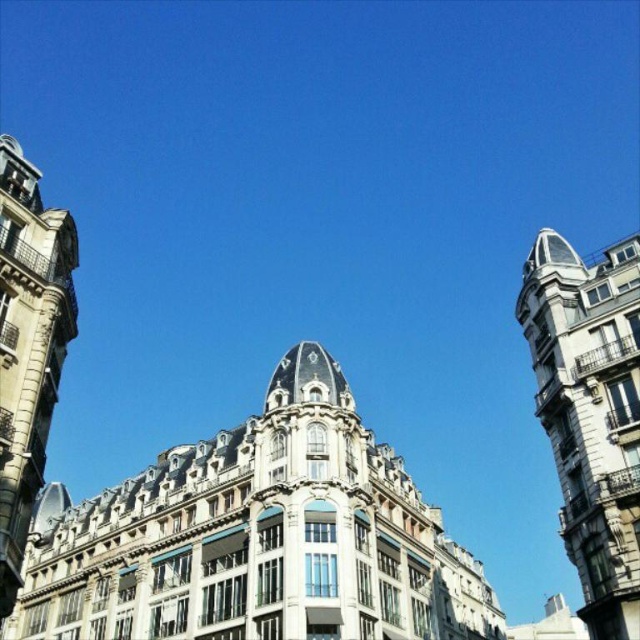
Describe the element at coordinates (257, 538) in the screenshot. I see `white stone building at center` at that location.

The width and height of the screenshot is (640, 640). In order to click on white stone building at center in this screenshot , I will do `click(257, 538)`.

You are a GUI agent. You are given a task and a screenshot of the screen. Output one action in this format:
    pyautogui.click(x=<x>, y=<y>)
    Task: Click on the white stone building at center
    
    Given the screenshot: What is the action you would take?
    pyautogui.click(x=257, y=538)

Does point (632, 449) come farther from viewer compared to point (77, 259)?

No, it is not.

Is white stone tower at upper right below stone tower at left?

Yes, white stone tower at upper right is below stone tower at left.

Measure the distance between point (612, 396) and camera.

A distance of 164.03 feet exists between point (612, 396) and camera.

Where is `white stone tower at upper right`? This screenshot has width=640, height=640. white stone tower at upper right is located at coordinates (589, 413).

Is white stone building at center shorter than stone tower at left?

No, white stone building at center is not shorter than stone tower at left.

Who is positioned more to the right, white stone building at center or stone tower at left?

Positioned to the right is white stone building at center.

Is point (461, 548) positioned before point (58, 227)?

No, it is not.

Identify the location of white stone building at center. (257, 538).